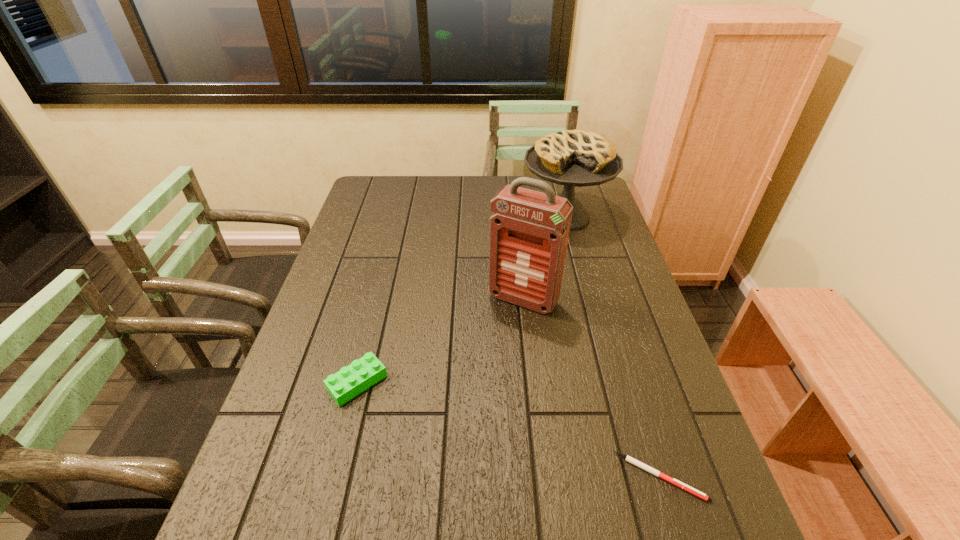
Locate an element on the screen. The width and height of the screenshot is (960, 540). the third tallest object is located at coordinates (350, 381).

Find the location of a particular element. Image resolution: width=960 pixels, height=540 pixels. the third farthest object is located at coordinates (350, 381).

Where is `pen`? This screenshot has width=960, height=540. pen is located at coordinates (637, 463).

The width and height of the screenshot is (960, 540). What are the coordinates of `the shortest object` in the screenshot? It's located at (637, 463).

This screenshot has height=540, width=960. Find the location of `the tallest object`. the tallest object is located at coordinates (529, 230).

You are a GUI agent. You are given a task and a screenshot of the screen. Output one action in this format:
    pyautogui.click(x=<x>, y=<y>)
    Task: Click on the first-aid kit
    This screenshot has width=960, height=540.
    Given the screenshot: What is the action you would take?
    pyautogui.click(x=529, y=230)

Where is `pie`? pie is located at coordinates (579, 158).

This screenshot has height=540, width=960. Identify the location of the third shortest object. (579, 158).

Find the location of a particular element. free spot located 0.380m on the back of the leftmost object is located at coordinates (387, 263).

Where is `blank space located on the front-facing side of the first-aid kit`? blank space located on the front-facing side of the first-aid kit is located at coordinates (501, 328).